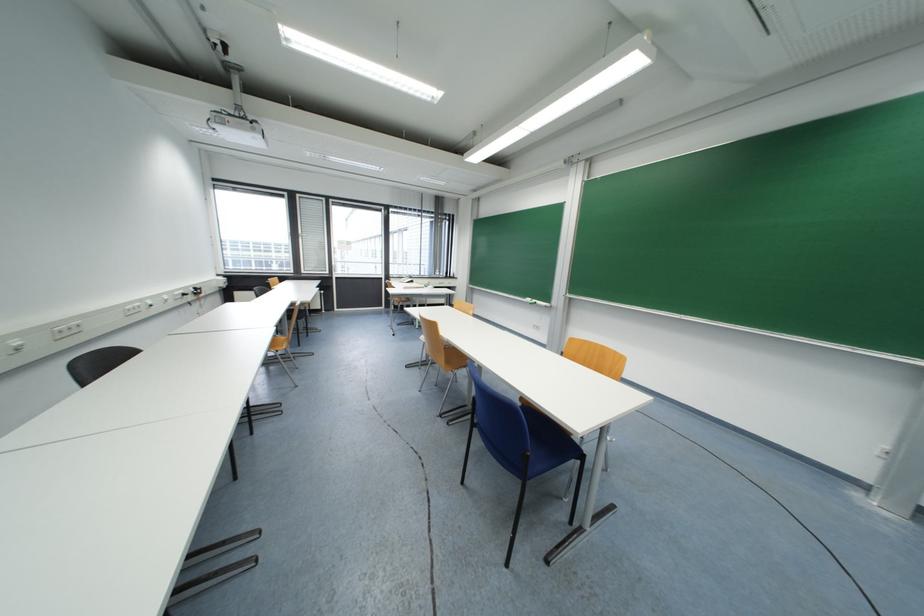
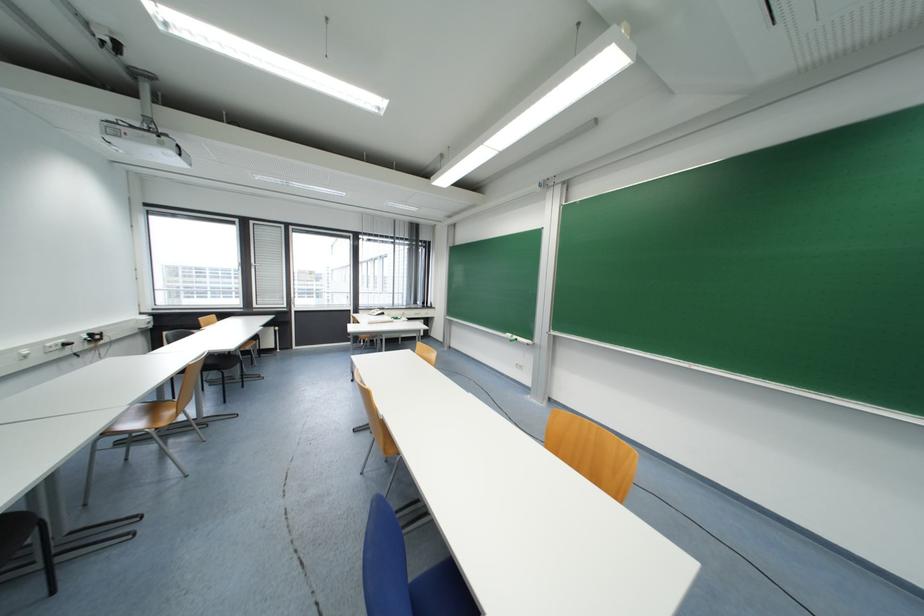
Question: Based on the continuous images, in which direction is the camera rotating? Reply with the corresponding letter.

Choices:
 (A) Left
 (B) Right
 (C) Up
 (D) Down

Answer: (C)